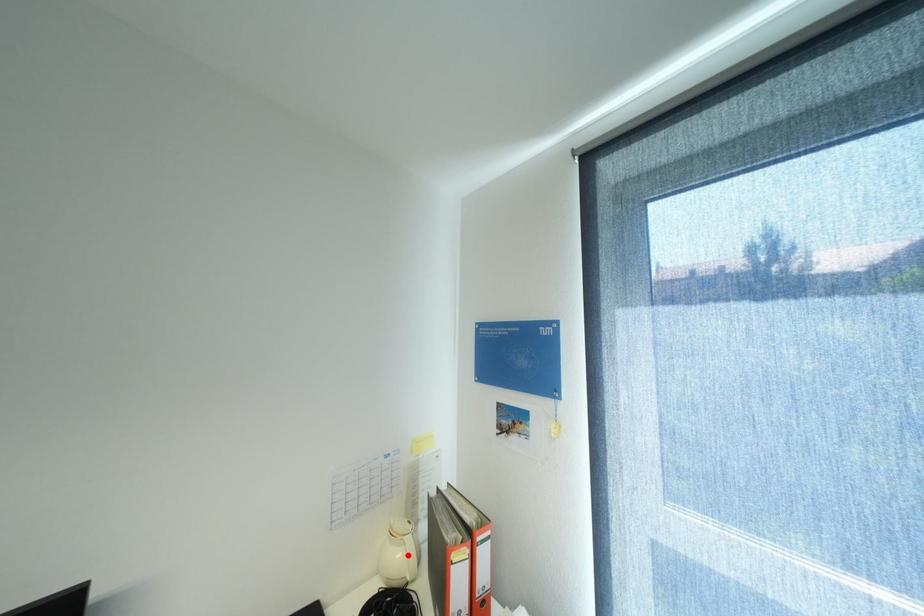
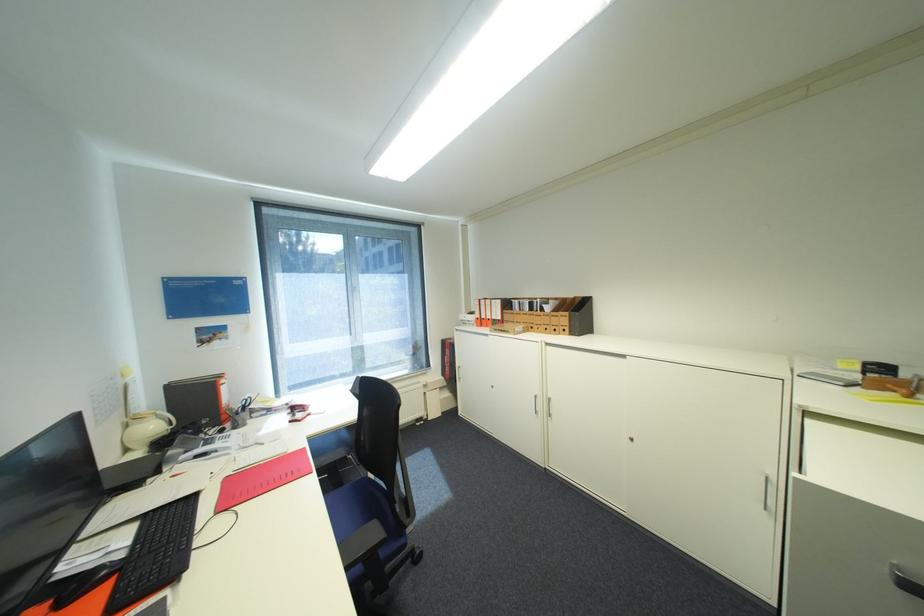
Where in the second image is the point corresponding to the highlighted location from the first image?

(161, 427)